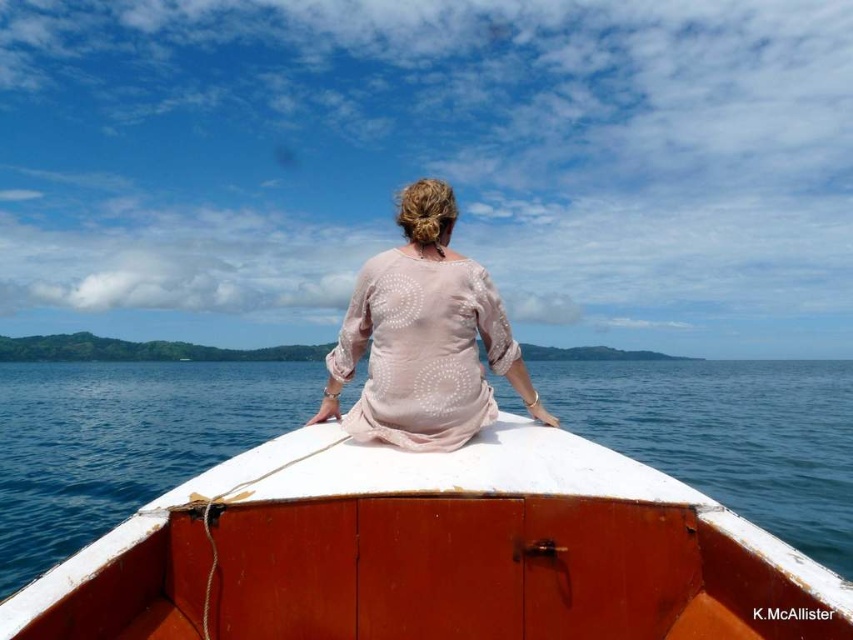
You are planning to take a photo of the white matte boat at center and the pink sheer blouse at center. Which object should you focus on first if you want to capture both in a single frame without moving the camera?

You should focus on the white matte boat at center first because it is larger in size than the pink sheer blouse at center, making it the primary subject for the frame.

You are a photographer trying to capture the white matte boat at center and the pink sheer blouse at center in a single frame. Which object should you focus on first to ensure both are in the frame without moving the camera?

The white matte boat at center is shorter than the pink sheer blouse at center, so you should focus on the pink sheer blouse at center first to ensure both are in the frame.

You are a photographer taking a picture of the scene. You notice the white matte boat at center and the pink sheer blouse at center. Which object should you focus on first if you want to capture both in sharp focus?

The white matte boat at center is closer to the viewer than the pink sheer blouse at center. To capture both in sharp focus, you should focus on the white matte boat at center first, as it is closer, and the depth of field may naturally include the farther object.